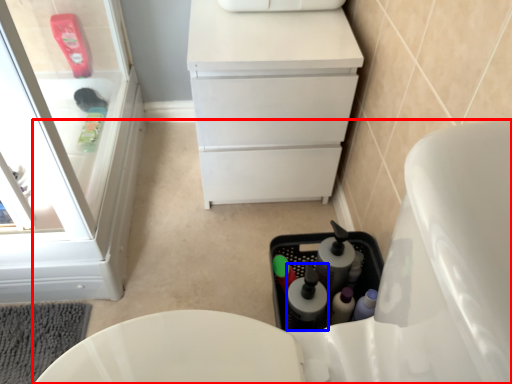
Question: Among these objects, which one is nearest to the camera, toilet (highlighted by a red box) or bottle (highlighted by a blue box)?

Choices:
 (A) toilet
 (B) bottle

Answer: (A)